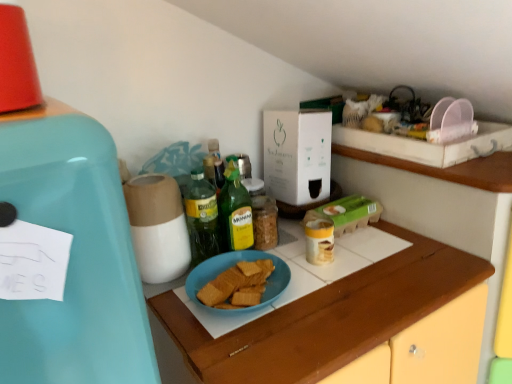
Question: From a real-world perspective, is teal matte refrigerator at left below white cardboard box at center?

Choices:
 (A) no
 (B) yes

Answer: (A)

Question: Can you confirm if teal matte refrigerator at left is taller than white cardboard box at center?

Choices:
 (A) yes
 (B) no

Answer: (B)

Question: Does teal matte refrigerator at left come behind white cardboard box at center?

Choices:
 (A) no
 (B) yes

Answer: (A)

Question: Is teal matte refrigerator at left positioned before white cardboard box at center?

Choices:
 (A) yes
 (B) no

Answer: (A)

Question: Does teal matte refrigerator at left have a lesser width compared to white cardboard box at center?

Choices:
 (A) yes
 (B) no

Answer: (A)

Question: From the image's perspective, is blue matte plate at center above or below green glass bottle at center, positioned as the second bottle in left-to-right order?

Choices:
 (A) below
 (B) above

Answer: (A)

Question: From a real-world perspective, relative to green glass bottle at center, which is the 1th bottle from right to left, is blue matte plate at center vertically above or below?

Choices:
 (A) below
 (B) above

Answer: (A)

Question: Looking at the image, does blue matte plate at center seem bigger or smaller compared to green glass bottle at center, which is the 1th bottle from right to left?

Choices:
 (A) small
 (B) big

Answer: (B)

Question: Visually, is blue matte plate at center positioned to the left or to the right of green glass bottle at center, which is the 1th bottle from right to left?

Choices:
 (A) right
 (B) left

Answer: (A)

Question: Which is correct: blue matte plate at center is inside white cardboard box at center, or outside of it?

Choices:
 (A) inside
 (B) outside

Answer: (B)

Question: Relative to white cardboard box at center, is blue matte plate at center in front or behind?

Choices:
 (A) front
 (B) behind

Answer: (A)

Question: Considering the positions of point (239, 283) and point (326, 115), is point (239, 283) closer or farther from the camera than point (326, 115)?

Choices:
 (A) closer
 (B) farther

Answer: (A)

Question: From the image's perspective, is blue matte plate at center located above or below white cardboard box at center?

Choices:
 (A) above
 (B) below

Answer: (B)

Question: Is green glass bottle at center, which is the 1th bottle from right to left, spatially inside blue matte plate at center, or outside of it?

Choices:
 (A) outside
 (B) inside

Answer: (A)

Question: From a real-world perspective, is green glass bottle at center, which is the 1th bottle from right to left, physically located above or below blue matte plate at center?

Choices:
 (A) above
 (B) below

Answer: (A)